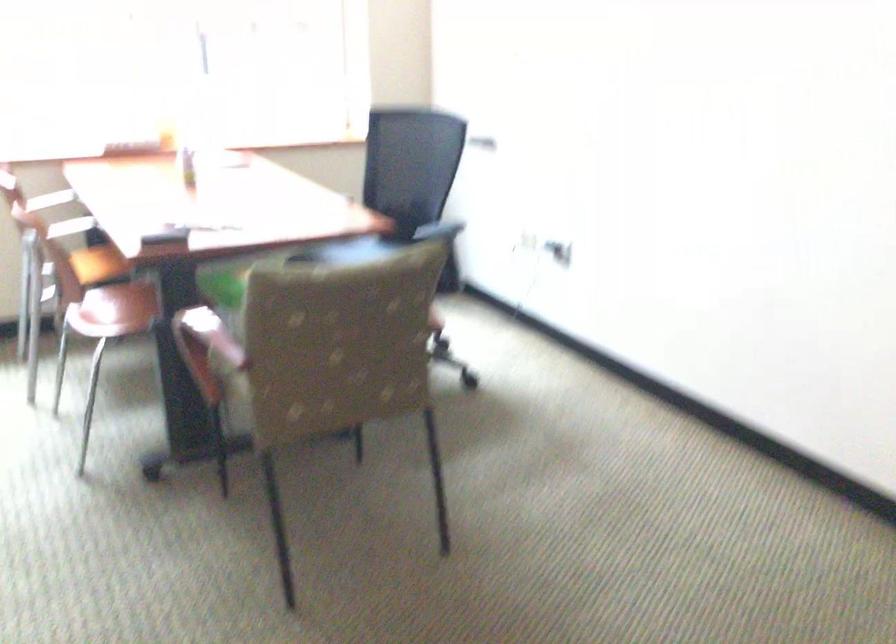
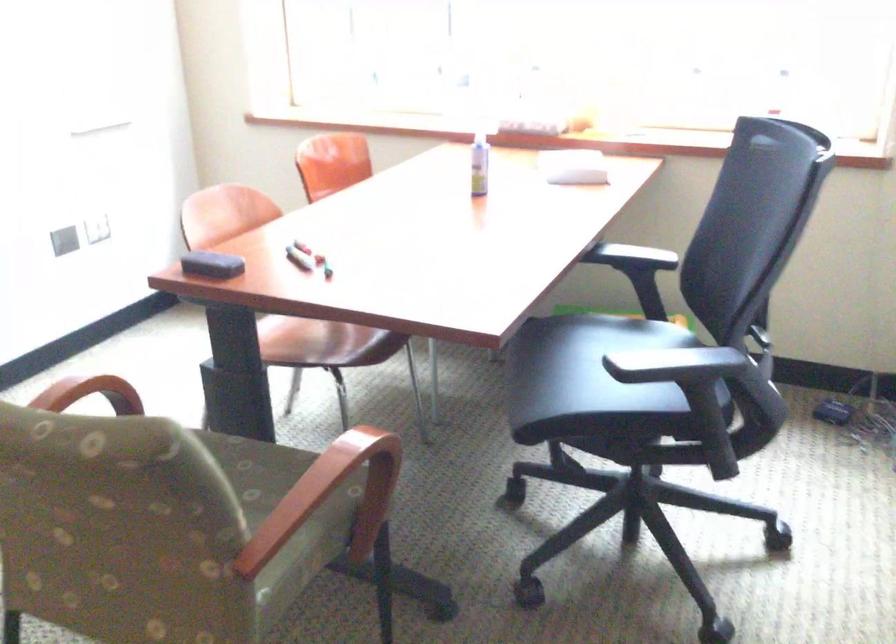
Locate, in the second image, the point that corresponds to pixel 440 225 in the first image.

(678, 359)